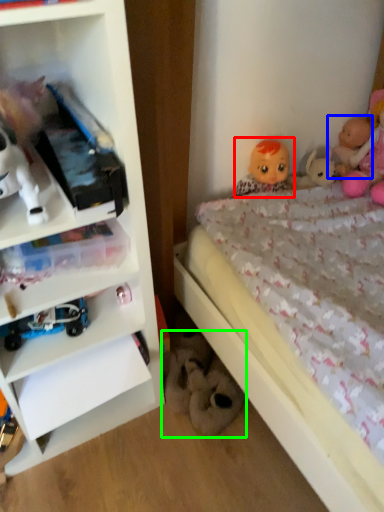
Question: Which object is positioned closest to doll (highlighted by a red box)? Select from doll (highlighted by a blue box) and toy (highlighted by a green box).

Choices:
 (A) doll
 (B) toy

Answer: (A)